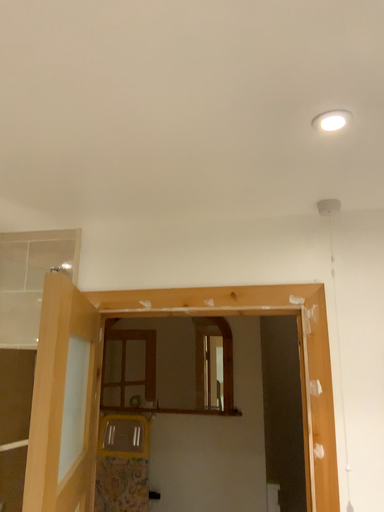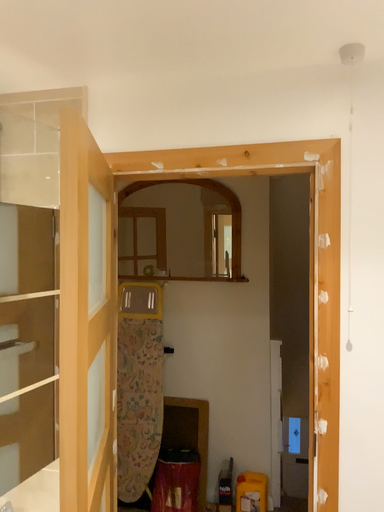
Question: How did the camera likely rotate when shooting the video?

Choices:
 (A) rotated upward
 (B) rotated downward

Answer: (B)